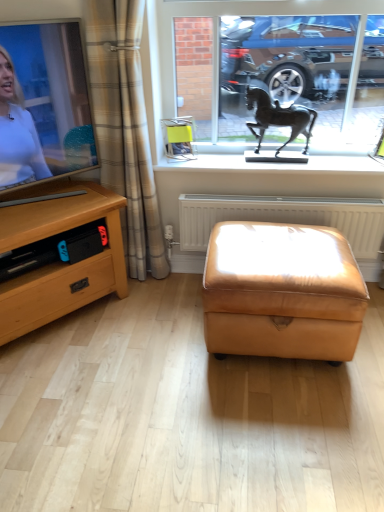
You are a GUI agent. You are given a task and a screenshot of the screen. Output one action in this format:
    pyautogui.click(x=<x>, y=<y>)
    Task: Click on the free space in front of wooden desk at left
    This screenshot has width=384, height=512.
    Given the screenshot: What is the action you would take?
    pyautogui.click(x=72, y=381)